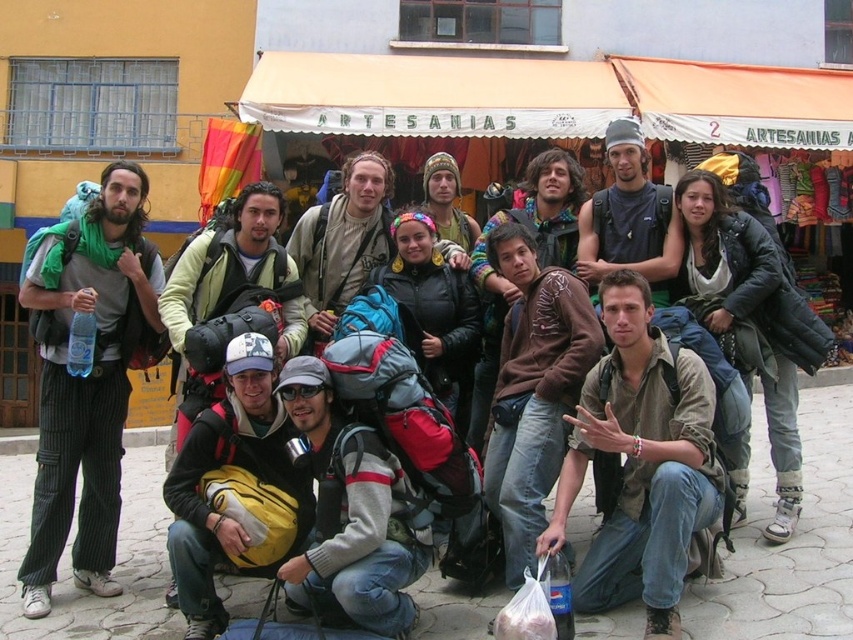
Does matte gray backpack at center appear on the left side of brown fuzzy sweater at center?

Yes, matte gray backpack at center is to the left of brown fuzzy sweater at center.

Is matte gray backpack at center bigger than brown fuzzy sweater at center?

No, matte gray backpack at center is not bigger than brown fuzzy sweater at center.

You are a GUI agent. You are given a task and a screenshot of the screen. Output one action in this format:
    pyautogui.click(x=<x>, y=<y>)
    Task: Click on the matte gray backpack at center
    
    Given the screenshot: What is the action you would take?
    pyautogui.click(x=341, y=243)

Is yellow backpack at lower center below brown fuzzy sweater at center?

Correct, yellow backpack at lower center is located below brown fuzzy sweater at center.

Locate an element on the screen. yellow backpack at lower center is located at coordinates (228, 500).

Is orange fabric canopy at upper center smaller than matte yellow backpack at center?

Actually, orange fabric canopy at upper center might be larger than matte yellow backpack at center.

Is point (549, 108) farther from viewer compared to point (238, 257)?

Yes, point (549, 108) is behind point (238, 257).

The height and width of the screenshot is (640, 853). What do you see at coordinates (548, 99) in the screenshot? I see `orange fabric canopy at upper center` at bounding box center [548, 99].

Identify the location of orange fabric canopy at upper center. Image resolution: width=853 pixels, height=640 pixels. (548, 99).